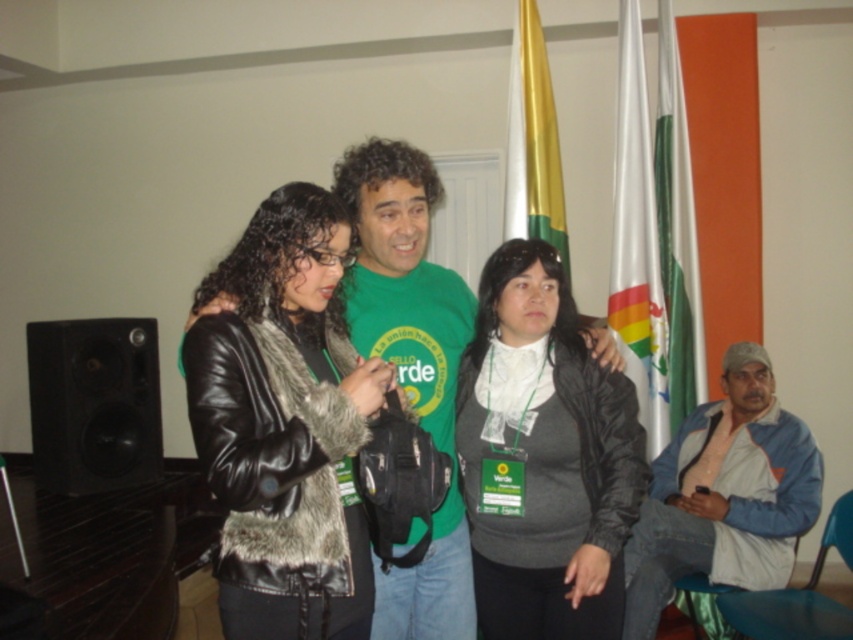
You are attending a meeting and see the white fabric flag at upper right and the green fabric flag at right. Which flag is located more to the left?

The white fabric flag at upper right is more to the left than the green fabric flag at right.

You are standing in the room and want to take a photo of the green fabric flag at right without including the denim jacket at lower right in the frame. Is it possible to do so by moving your camera position?

The denim jacket at lower right is in front of the green fabric flag at right, so moving the camera position might allow you to angle around the denim jacket to capture the flag without obstruction. However, this depends on the space available and the angle required to avoid the jacket.